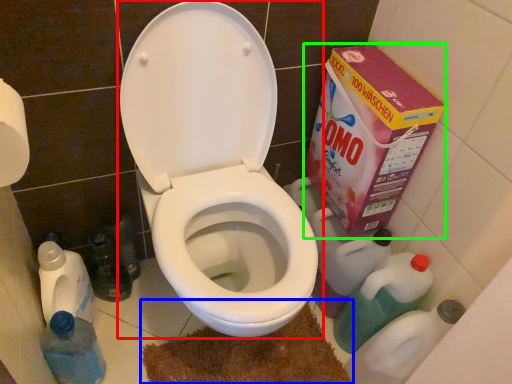
Question: Considering the real-world distances, which object is farthest from toilet (highlighted by a red box)? bath mat (highlighted by a blue box) or cardboard box (highlighted by a green box)?

Choices:
 (A) bath mat
 (B) cardboard box

Answer: (A)